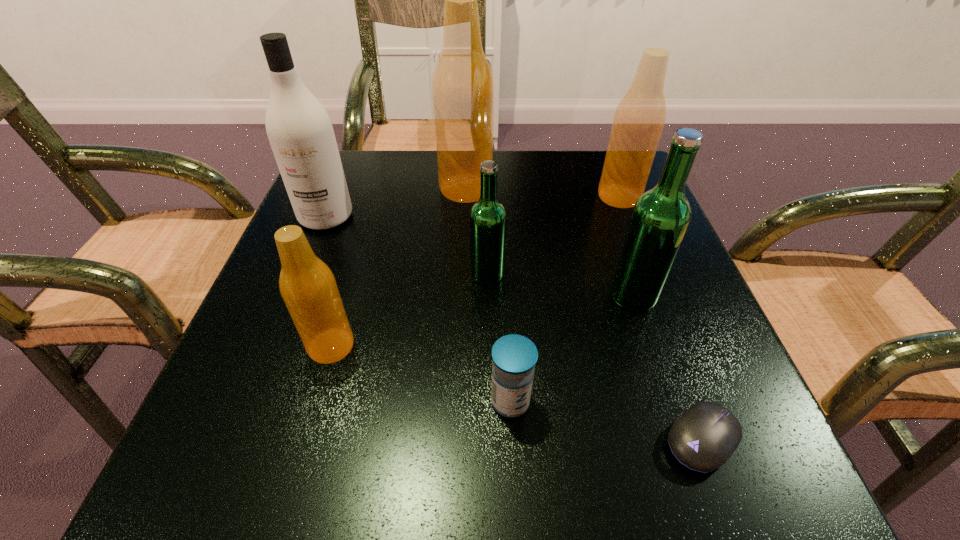
Where is `free spot that satisfies the following two spatial constraints: 1. on the back side of the left green beer bottle; 2. on the left side of the third nearest object`? The image size is (960, 540). free spot that satisfies the following two spatial constraints: 1. on the back side of the left green beer bottle; 2. on the left side of the third nearest object is located at coordinates point(352,274).